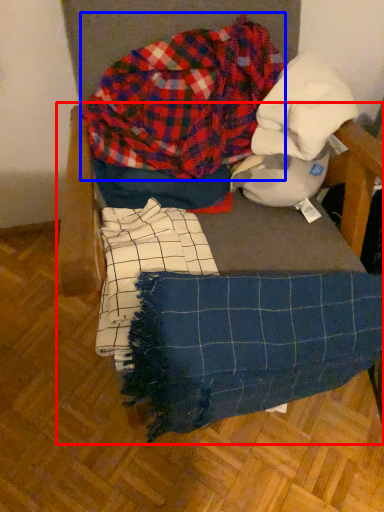
Question: Which point is closer to the camera, furniture (highlighted by a red box) or flannel (highlighted by a blue box)?

Choices:
 (A) furniture
 (B) flannel

Answer: (A)